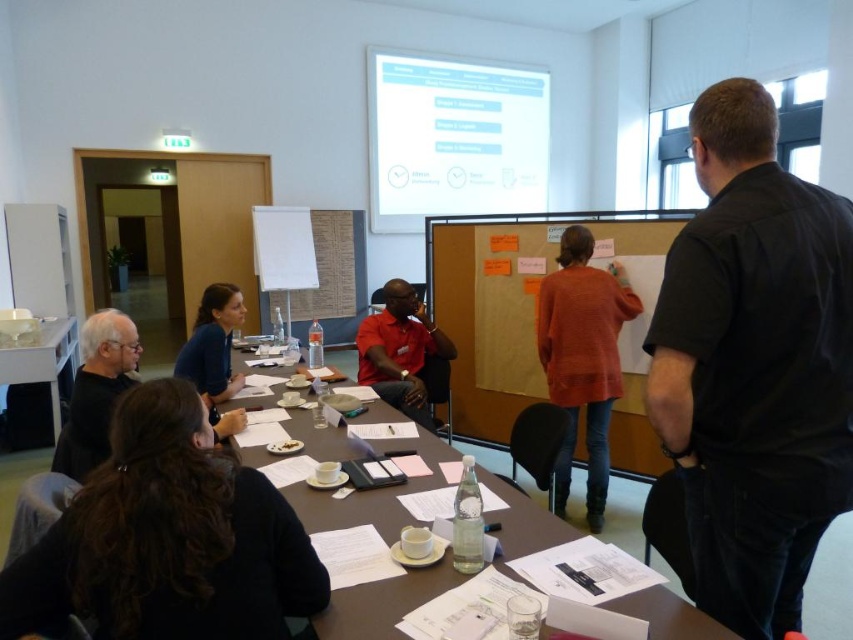
You are a photographer trying to capture a group photo of the meeting participants. You want to ensure that everyone is visible in the photo. Considering the positions and heights of the black matte shirt at lower left and the matte red shirt at center, which participant should you ask to stand on a small stool to avoid blocking others?

The black matte shirt at lower left has a lesser height compared to the matte red shirt at center, so you should ask the black matte shirt at lower left to stand on a small stool to ensure they are visible and not blocked by others.

You are a participant in the meeting and want to see the matte red shirt at center clearly. However, the orange fabric bulletin board at center is blocking your view. Can you move the bulletin board to get a better look?

The matte red shirt at center is behind the orange fabric bulletin board at center, so moving the bulletin board would allow you to see the shirt more clearly.

Looking at this image, you are a photographer taking a group photo of the participants. You want to ensure both the black matte shirt at lower left and the matte red shirt at center are visible in the frame. Based on their positions, which one should you focus on first to ensure both are in the shot?

Since the black matte shirt at lower left is to the left of the matte red shirt at center, you should focus on the matte red shirt at center first to ensure both are in the frame.